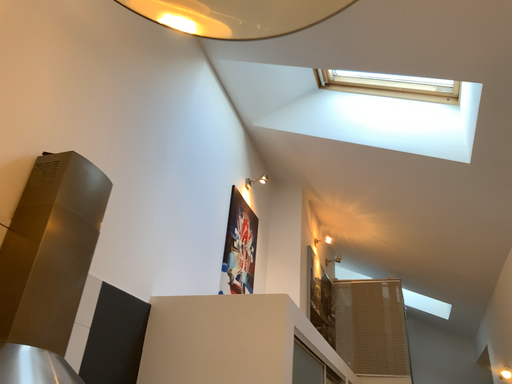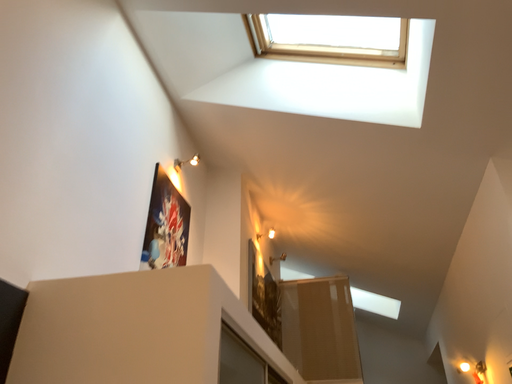
Question: How did the camera likely rotate when shooting the video?

Choices:
 (A) rotated right
 (B) rotated left

Answer: (A)